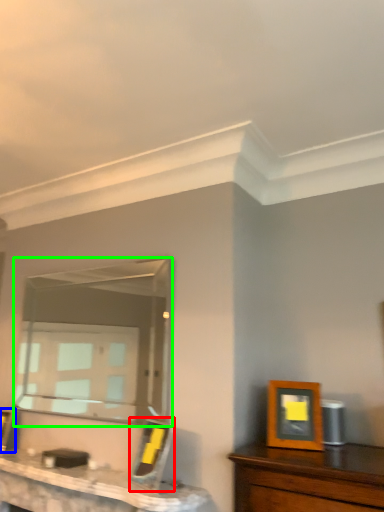
Question: Based on their relative distances, which object is farther from picture frame (highlighted by a red box)? Choose from picture frame (highlighted by a blue box) and mirror (highlighted by a green box).

Choices:
 (A) picture frame
 (B) mirror

Answer: (B)